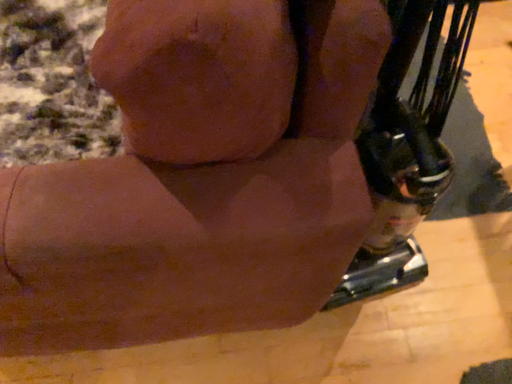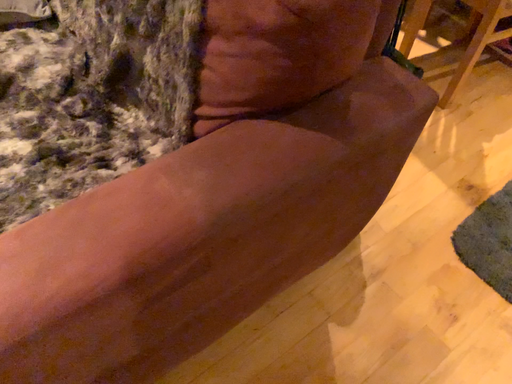
Question: How did the camera likely rotate when shooting the video?

Choices:
 (A) rotated right
 (B) rotated left

Answer: (A)